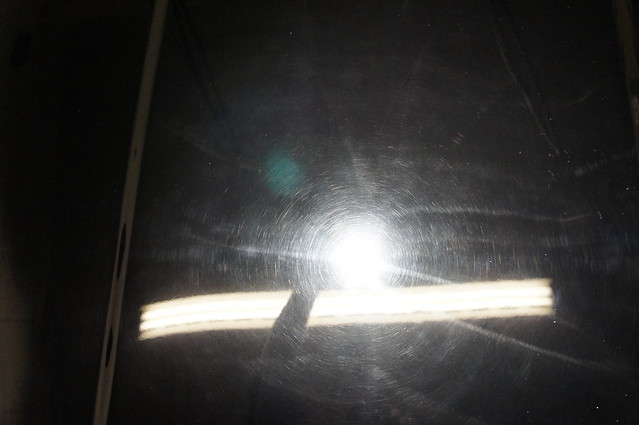
Locate an element on the screen. bright light reflection is located at coordinates (360, 247).